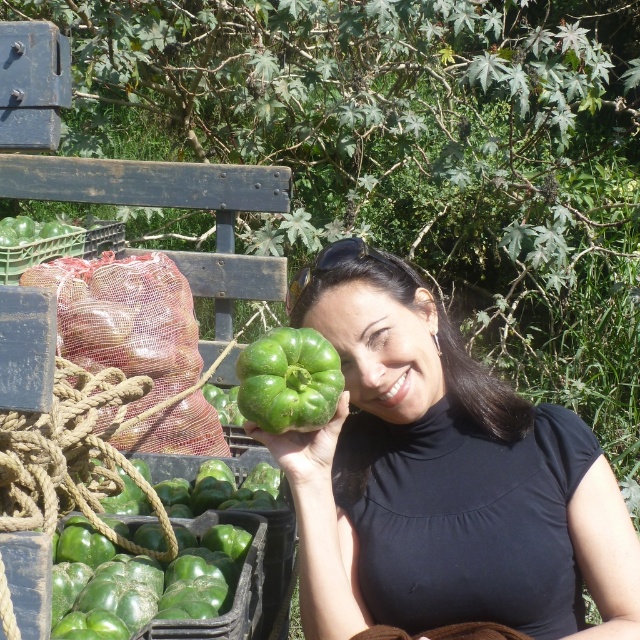
Is green matte pepper at center closer to camera compared to green matte bell pepper at center?

No, it is not.

Can you confirm if green matte pepper at center is positioned above green matte bell pepper at center?

Incorrect, green matte pepper at center is not positioned above green matte bell pepper at center.

At what (x,y) coordinates should I click in order to perform the action: click on green matte pepper at center. Please return your answer as a coordinate pair (x, y). The image size is (640, 640). Looking at the image, I should click on (442, 477).

This screenshot has height=640, width=640. I want to click on green matte pepper at center, so click(442, 477).